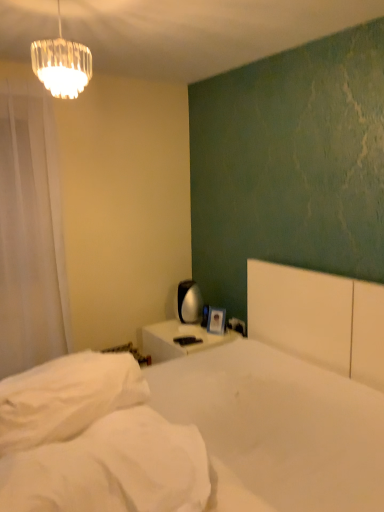
What are the coordinates of `free space above white glossy nightstand at center (from a real-world perspective)` in the screenshot? It's located at (180, 331).